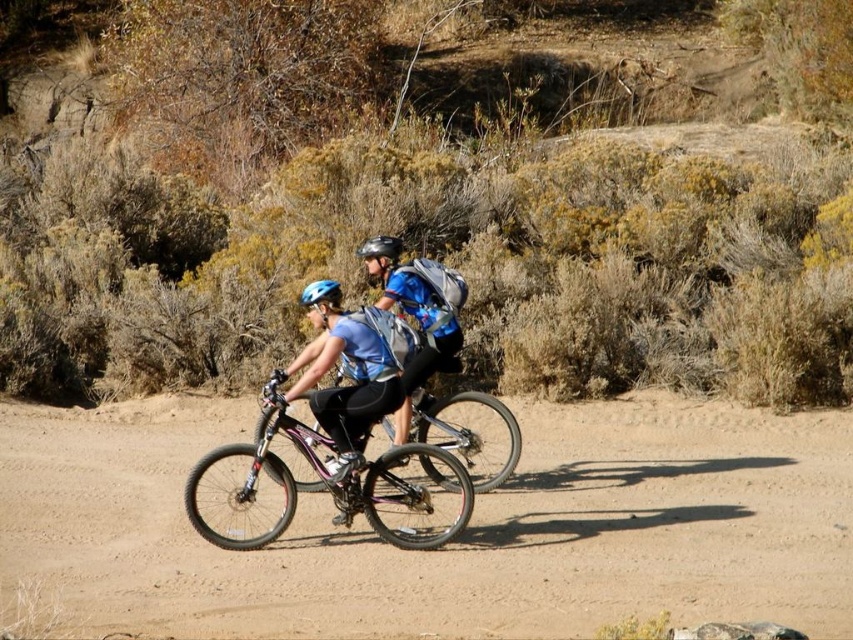
You are a photographer trying to capture a clear shot of both the matte blue helmet at center and the blue matte helmet at center. Since both are at the center, can you determine which one is on the right side from your perspective?

The matte blue helmet at center is positioned on the right side of blue matte helmet at center, so from your perspective, the matte blue helmet at center is the one on the right.

You are a drone operator trying to capture aerial footage of the two cyclists. You notice two specific points in the scene marked as point 1 at coordinates [317,298] and point 2 at [386,253]. Which point should you focus on if you want to get a clearer image of the cyclist in front?

Point 1 at coordinates [317,298] is closer to the camera than point 2 at [386,253]. Therefore, focusing on point 1 will provide a clearer image of the cyclist in front since it is nearer to the camera.

You are a photographer trying to capture a clear shot of both the blue matte helmet at center and the metallic reflective helmet at center. Since you want to ensure both are visible in your frame, which helmet should you focus on first to avoid blurring due to their positions?

The blue matte helmet at center is positioned on the left side of metallic reflective helmet at center, so you should focus on the blue matte helmet at center first to ensure both are in focus as they are side by side.